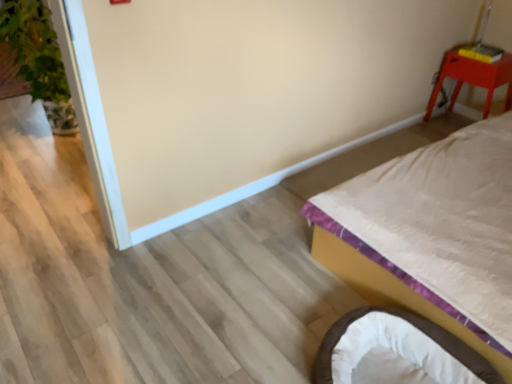
Where is `white satin bed at right`? The width and height of the screenshot is (512, 384). white satin bed at right is located at coordinates (391, 286).

What do you see at coordinates (34, 48) in the screenshot? The height and width of the screenshot is (384, 512). I see `green leafy plant at left` at bounding box center [34, 48].

Identify the location of white satin bed at right. This screenshot has width=512, height=384. (391, 286).

Would you say matte red stool at upper right is to the left or to the right of white satin bed at right in the picture?

matte red stool at upper right is positioned on white satin bed at right's right side.

Is the surface of matte red stool at upper right in direct contact with white satin bed at right?

No, matte red stool at upper right is not with white satin bed at right.

Is matte red stool at upper right wider or thinner than white satin bed at right?

matte red stool at upper right is thinner than white satin bed at right.

Is white satin bed at right closer to the viewer compared to green leafy plant at left?

Yes, it is.

Does point (374, 273) come farther from viewer compared to point (3, 34)?

No, (374, 273) is closer to viewer.

Looking at this image, can you confirm if white satin bed at right is thinner than green leafy plant at left?

No, white satin bed at right is not thinner than green leafy plant at left.

Is white satin bed at right aimed at green leafy plant at left?

No, white satin bed at right does not turn towards green leafy plant at left.

Is white satin bed at right facing away from soft white fabric infant bed at lower right?

No, white satin bed at right's orientation is not away from soft white fabric infant bed at lower right.

Can you confirm if white satin bed at right is thinner than soft white fabric infant bed at lower right?

No, white satin bed at right is not thinner than soft white fabric infant bed at lower right.

Considering the sizes of objects white satin bed at right and soft white fabric infant bed at lower right in the image provided, who is smaller, white satin bed at right or soft white fabric infant bed at lower right?

soft white fabric infant bed at lower right.

Is white satin bed at right behind soft white fabric infant bed at lower right?

No, white satin bed at right is in front of soft white fabric infant bed at lower right.

Which object is further away from the camera, green leafy plant at left or soft white fabric infant bed at lower right?

green leafy plant at left is further away from the camera.

Locate an element on the screen. plant located on the left of soft white fabric infant bed at lower right is located at coordinates (34, 48).

Choose the correct answer: Is green leafy plant at left inside soft white fabric infant bed at lower right or outside it?

green leafy plant at left cannot be found inside soft white fabric infant bed at lower right.

Does point (39, 63) appear closer or farther from the camera than point (481, 375)?

Clearly, point (39, 63) is more distant from the camera than point (481, 375).

From the image's perspective, is soft white fabric infant bed at lower right positioned above or below green leafy plant at left?

Clearly, from the image's perspective, soft white fabric infant bed at lower right is below green leafy plant at left.

Is soft white fabric infant bed at lower right not near green leafy plant at left?

Yes, soft white fabric infant bed at lower right and green leafy plant at left are quite far apart.

Who is bigger, soft white fabric infant bed at lower right or green leafy plant at left?

Bigger between the two is green leafy plant at left.

Is soft white fabric infant bed at lower right located outside green leafy plant at left?

Yes.

Is matte red stool at upper right oriented towards soft white fabric infant bed at lower right?

Yes, matte red stool at upper right is turned towards soft white fabric infant bed at lower right.

Considering the relative sizes of matte red stool at upper right and soft white fabric infant bed at lower right in the image provided, is matte red stool at upper right bigger than soft white fabric infant bed at lower right?

Yes, matte red stool at upper right is bigger than soft white fabric infant bed at lower right.

Is point (444, 61) closer or farther from the camera than point (316, 379)?

Clearly, point (444, 61) is more distant from the camera than point (316, 379).

Is matte red stool at upper right beside soft white fabric infant bed at lower right?

No, matte red stool at upper right is not making contact with soft white fabric infant bed at lower right.

Is matte red stool at upper right aimed at green leafy plant at left?

A: No, matte red stool at upper right is not oriented towards green leafy plant at left.

Is matte red stool at upper right positioned beyond the bounds of green leafy plant at left?

Absolutely, matte red stool at upper right is external to green leafy plant at left.

Is the surface of matte red stool at upper right in direct contact with green leafy plant at left?

No, matte red stool at upper right is not beside green leafy plant at left.

Which object is positioned more to the left, matte red stool at upper right or green leafy plant at left?

Positioned to the left is green leafy plant at left.

Identify the location of bed that appears on the left of matte red stool at upper right. pyautogui.click(x=391, y=286).

Locate an element on the screen. The height and width of the screenshot is (384, 512). bed below the green leafy plant at left (from the image's perspective) is located at coordinates (391, 286).

Considering their positions, is white satin bed at right positioned further to soft white fabric infant bed at lower right than matte red stool at upper right?

Based on the image, matte red stool at upper right appears to be further to soft white fabric infant bed at lower right.

Based on their spatial positions, is green leafy plant at left or soft white fabric infant bed at lower right closer to matte red stool at upper right?

Among the two, soft white fabric infant bed at lower right is located nearer to matte red stool at upper right.

When comparing their distances from green leafy plant at left, does soft white fabric infant bed at lower right or matte red stool at upper right seem closer?

soft white fabric infant bed at lower right lies closer to green leafy plant at left than the other object.

Which object lies nearer to the anchor point soft white fabric infant bed at lower right, matte red stool at upper right or green leafy plant at left?

matte red stool at upper right lies closer to soft white fabric infant bed at lower right than the other object.

Considering their positions, is white satin bed at right positioned closer to matte red stool at upper right than soft white fabric infant bed at lower right?

The object closer to matte red stool at upper right is white satin bed at right.

Which object lies nearer to the anchor point soft white fabric infant bed at lower right, white satin bed at right or green leafy plant at left?

white satin bed at right.

Estimate the real-world distances between objects in this image. Which object is closer to soft white fabric infant bed at lower right, matte red stool at upper right or white satin bed at right?

white satin bed at right.

Considering their positions, is green leafy plant at left positioned closer to matte red stool at upper right than white satin bed at right?

white satin bed at right lies closer to matte red stool at upper right than the other object.

I want to click on infant bed between green leafy plant at left and white satin bed at right, so click(414, 328).

Where is `infant bed located between white satin bed at right and matte red stool at upper right in the depth direction`? This screenshot has height=384, width=512. infant bed located between white satin bed at right and matte red stool at upper right in the depth direction is located at coordinates (414, 328).

Where is `bed situated between green leafy plant at left and matte red stool at upper right from left to right`? bed situated between green leafy plant at left and matte red stool at upper right from left to right is located at coordinates (391, 286).

The image size is (512, 384). In order to click on infant bed situated between green leafy plant at left and matte red stool at upper right from left to right in this screenshot , I will do `click(414, 328)`.